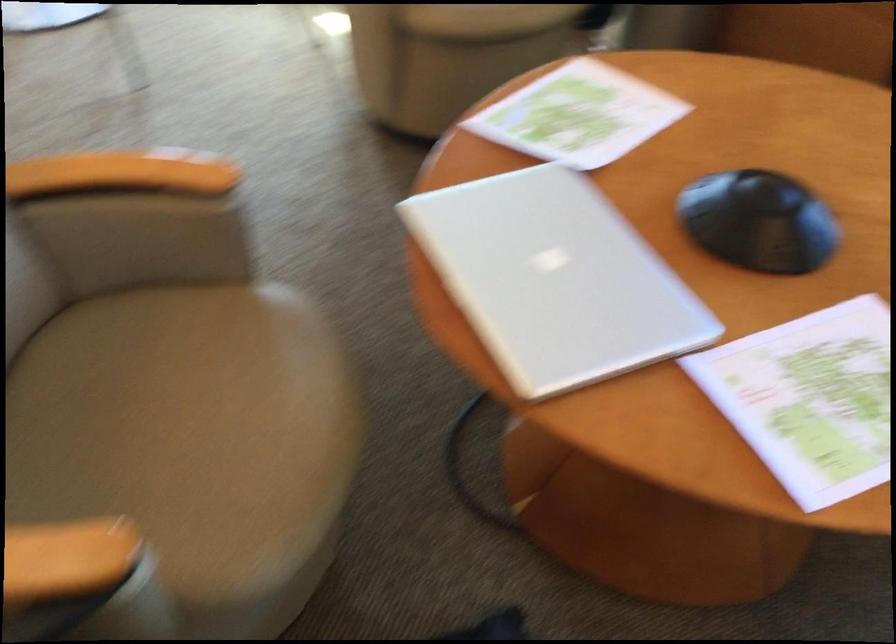
What do you see at coordinates (187, 429) in the screenshot? I see `the chair sitting surface` at bounding box center [187, 429].